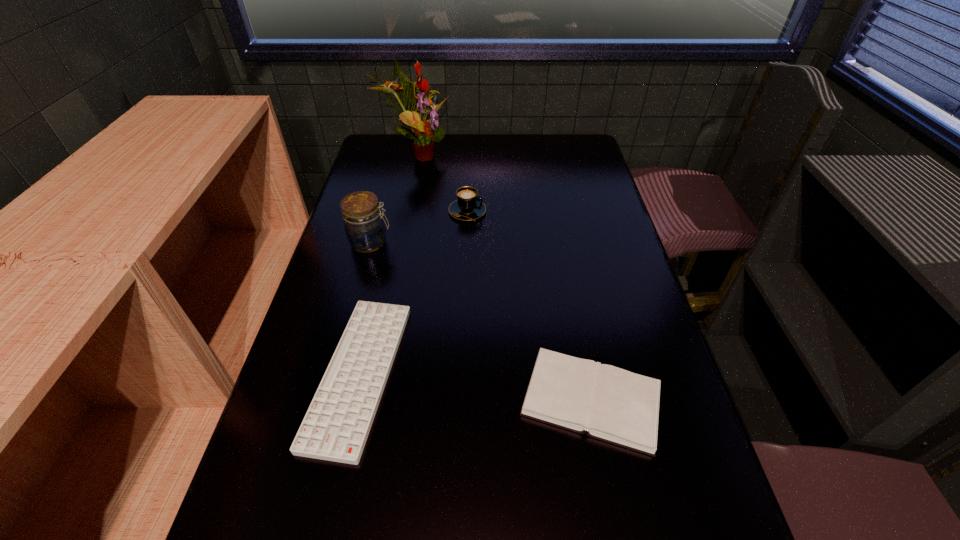
Locate an element on the screen. object that can be found as the fourth closest to the bouquet is located at coordinates click(x=614, y=405).

At what (x,y) coordinates should I click in order to perform the action: click on vacant position in the image that satisfies the following two spatial constraints: 1. on the back side of the computer keyboard; 2. on the right side of the fourth nearest object. Please return your answer as a coordinate pair (x, y). This screenshot has width=960, height=540. Looking at the image, I should click on (396, 212).

Find the location of a particular element. vacant space that satisfies the following two spatial constraints: 1. on the back side of the shortest object; 2. on the lid of the third farthest object is located at coordinates (389, 242).

Locate an element on the screen. This screenshot has height=540, width=960. free space that satisfies the following two spatial constraints: 1. on the front side of the computer keyboard; 2. on the left side of the rightmost object is located at coordinates (353, 400).

The width and height of the screenshot is (960, 540). What are the coordinates of `blank space that satisfies the following two spatial constraints: 1. on the back side of the fourth nearest object; 2. on the right side of the computer keyboard` in the screenshot? It's located at (396, 212).

Locate an element on the screen. free location that satisfies the following two spatial constraints: 1. on the front-facing side of the hardback book; 2. on the right side of the farthest object is located at coordinates (366, 400).